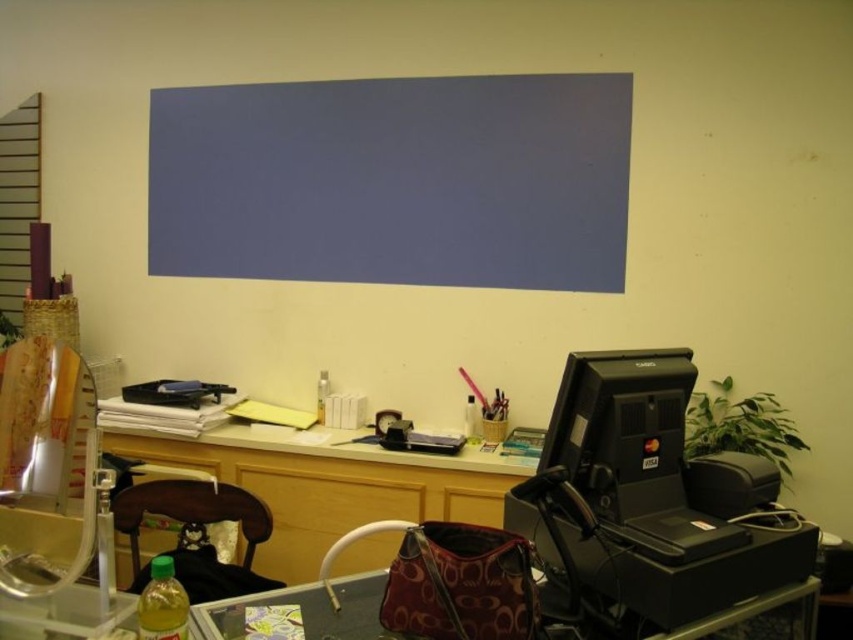
You are a delivery person who needs to place a package on the desk. The package is 2 meters long. Can you fit it on the desk between the black cash register or POS system on the right side and the point at coordinates point (218, 515)?

The distance between the black cash register or POS system on the right side and the point at coordinates point (218, 515) is 1.90 meters. Since the package is 2 meters long, it cannot fit in the available space.

You are organizing the office and need to place a new poster on the wall. The poster is meant to be above the wooden desk at center. Where should you position it in relation to the metal grid at left?

The wooden desk at center is below the metal grid at left, so you should place the poster above the wooden desk at center, which would be below the metal grid at left.